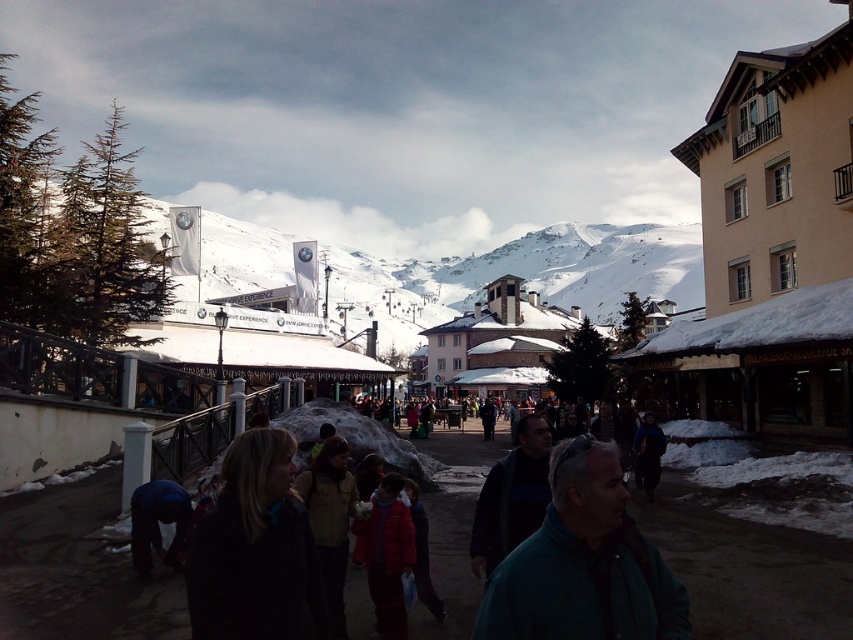
You are a photographer trying to capture both the green matte jacket at center and the dark brown jacket at lower left in a single shot. Based on their heights, which jacket will appear smaller in the photo?

The green matte jacket at center appears smaller in the photo because it has a lesser height compared to the dark brown jacket at lower left.

Looking at this image, you are a photographer trying to capture both the green matte jacket at center and the dark brown jacket at lower left in a single frame. Given their sizes, which jacket will appear larger in the photo?

The green matte jacket at center will appear larger in the photo because its width surpasses that of the dark brown jacket at lower left.